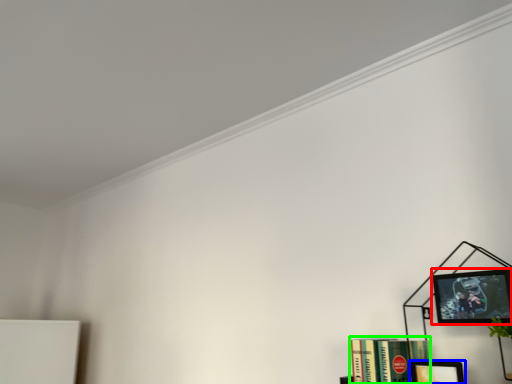
Question: Which object is positioned closest to picture frame (highlighted by a red box)? Select from picture frame (highlighted by a blue box) and book (highlighted by a green box).

Choices:
 (A) picture frame
 (B) book

Answer: (A)